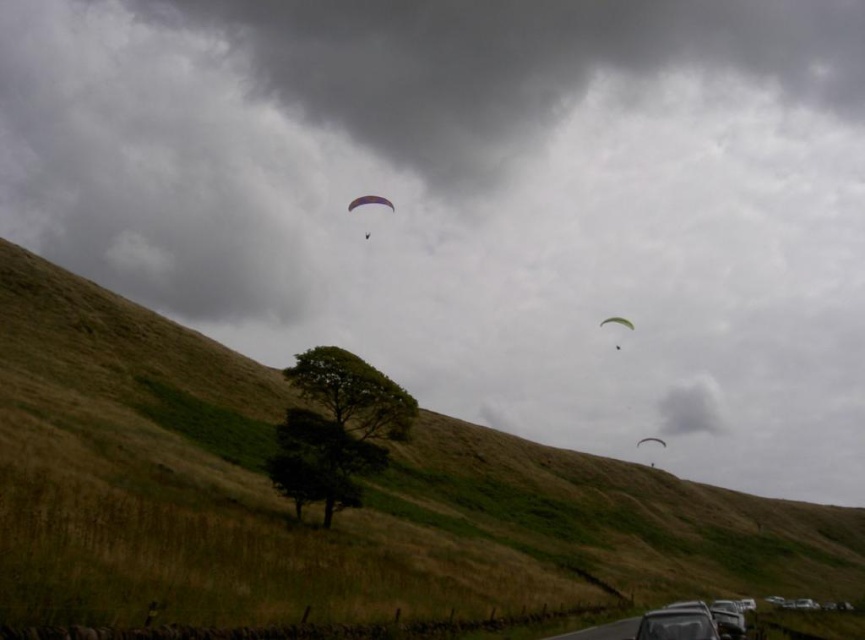
Question: Which point is closer to the camera?

Choices:
 (A) green fabric parachute at center
 (B) green grassy hillside at center
 (C) white matte parachute at center

Answer: (B)

Question: Considering the real-world distances, which object is closest to the green grassy hillside at center?

Choices:
 (A) silver metallic car at lower right
 (B) black glossy car at lower right

Answer: (A)

Question: Which point is farther to the camera?

Choices:
 (A) (23, 445)
 (B) (628, 328)
 (C) (376, 202)

Answer: (B)

Question: Can you confirm if silver metallic car at lower right is positioned above purple fabric parachute at center?

Choices:
 (A) yes
 (B) no

Answer: (B)

Question: From the image, what is the correct spatial relationship of green grassy hillside at center in relation to purple fabric parachute at center?

Choices:
 (A) left
 (B) right

Answer: (B)

Question: Is green grassy hillside at center above black glossy car at lower right?

Choices:
 (A) yes
 (B) no

Answer: (B)